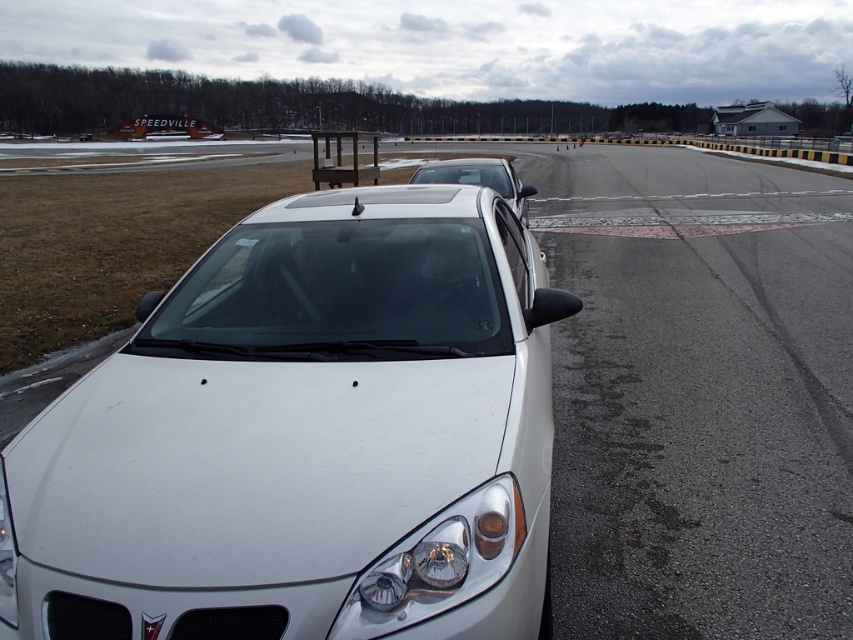
Question: Is the position of glossy plastic headlight at center more distant than that of satin white sedan at center?

Choices:
 (A) no
 (B) yes

Answer: (A)

Question: Does glossy plastic headlight at center have a lesser width compared to satin white sedan at center?

Choices:
 (A) no
 (B) yes

Answer: (B)

Question: Can you confirm if white glossy sedan at center is positioned to the left of glossy plastic headlight at center?

Choices:
 (A) no
 (B) yes

Answer: (B)

Question: Among these objects, which one is farthest from the camera?

Choices:
 (A) satin white sedan at center
 (B) glossy plastic headlight at center

Answer: (A)

Question: Which of the following is the farthest from the observer?

Choices:
 (A) (228, 346)
 (B) (422, 180)

Answer: (B)

Question: Which object appears closest to the camera in this image?

Choices:
 (A) glossy plastic headlight at center
 (B) white glossy sedan at center

Answer: (B)